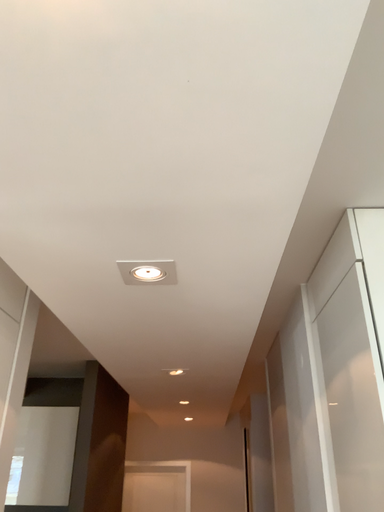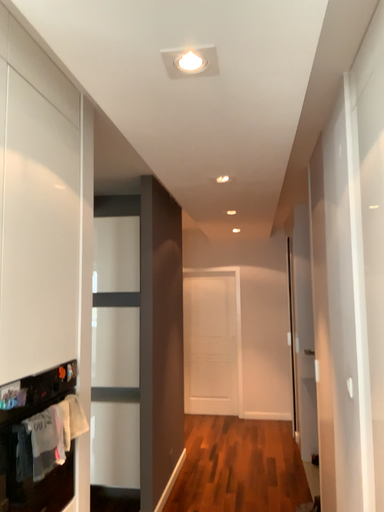
Question: How did the camera likely rotate when shooting the video?

Choices:
 (A) rotated upward
 (B) rotated downward

Answer: (B)